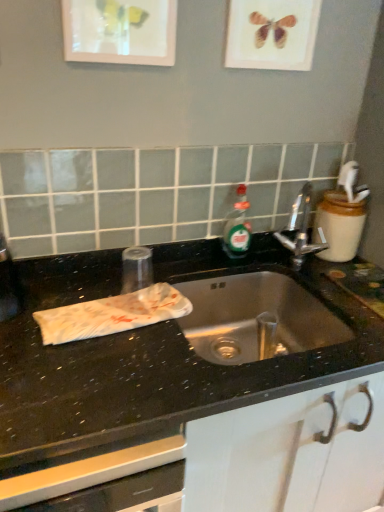
Question: Is matte glass picture frame at upper center, the first picture frame positioned from the left, at the right side of polished chrome faucet at center?

Choices:
 (A) yes
 (B) no

Answer: (B)

Question: Is matte glass picture frame at upper center, the first picture frame positioned from the left, facing towards polished chrome faucet at center?

Choices:
 (A) yes
 (B) no

Answer: (B)

Question: Is polished chrome faucet at center a part of matte glass picture frame at upper center, the first picture frame positioned from the left?

Choices:
 (A) no
 (B) yes

Answer: (A)

Question: From the image's perspective, would you say matte glass picture frame at upper center, the second picture frame when ordered from right to left, is positioned over polished chrome faucet at center?

Choices:
 (A) yes
 (B) no

Answer: (A)

Question: Is matte glass picture frame at upper center, the second picture frame when ordered from right to left, at the left side of polished chrome faucet at center?

Choices:
 (A) yes
 (B) no

Answer: (A)

Question: Looking at the image, does black granite sink at center seem bigger or smaller compared to matte glass picture frame at upper center, the second picture frame when ordered from right to left?

Choices:
 (A) big
 (B) small

Answer: (A)

Question: Considering the positions of point (172, 380) and point (109, 6), is point (172, 380) closer or farther from the camera than point (109, 6)?

Choices:
 (A) farther
 (B) closer

Answer: (B)

Question: Looking at their shapes, would you say black granite sink at center is wider or thinner than matte glass picture frame at upper center, the second picture frame when ordered from right to left?

Choices:
 (A) wide
 (B) thin

Answer: (A)

Question: Is black granite sink at center taller or shorter than matte glass picture frame at upper center, the second picture frame when ordered from right to left?

Choices:
 (A) short
 (B) tall

Answer: (B)

Question: In the image, is matte wooden picture frame at upper center, the first picture frame in the right-to-left sequence, positioned in front of or behind black granite sink at center?

Choices:
 (A) front
 (B) behind

Answer: (B)

Question: From a real-world perspective, is matte wooden picture frame at upper center, the first picture frame in the right-to-left sequence, physically located above or below black granite sink at center?

Choices:
 (A) below
 (B) above

Answer: (B)

Question: Is matte wooden picture frame at upper center, the second picture frame from the left, bigger or smaller than black granite sink at center?

Choices:
 (A) small
 (B) big

Answer: (A)

Question: Is matte wooden picture frame at upper center, the second picture frame from the left, spatially inside black granite sink at center, or outside of it?

Choices:
 (A) inside
 (B) outside

Answer: (B)

Question: From their relative heights in the image, would you say matte glass picture frame at upper center, the first picture frame positioned from the left, is taller or shorter than black granite sink at center?

Choices:
 (A) short
 (B) tall

Answer: (A)

Question: Which is correct: matte glass picture frame at upper center, the first picture frame positioned from the left, is inside black granite sink at center, or outside of it?

Choices:
 (A) inside
 (B) outside

Answer: (B)